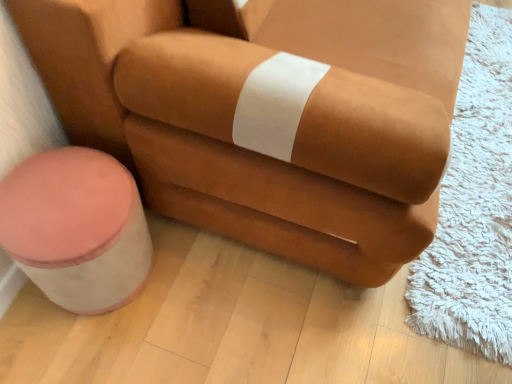
Find the location of a particular element. empty space that is ontop of pink fabric stool at lower left is located at coordinates (60, 200).